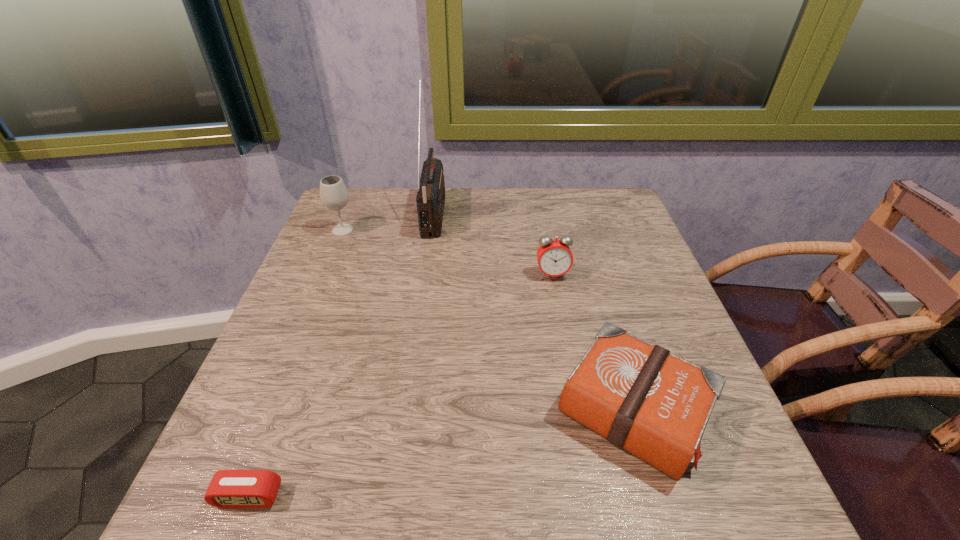
Find the location of a particular element. This screenshot has height=540, width=960. vacant space situated on the front-facing side of the third farthest object is located at coordinates (565, 347).

Locate an element on the screen. vacant area situated on the left of the Bible is located at coordinates (414, 411).

Find the location of a particular element. Image resolution: width=960 pixels, height=540 pixels. radio receiver present at the far edge is located at coordinates (430, 199).

Locate an element on the screen. The width and height of the screenshot is (960, 540). wineglass that is at the far edge is located at coordinates (334, 195).

You are a GUI agent. You are given a task and a screenshot of the screen. Output one action in this format:
    pyautogui.click(x=<x>, y=<y>)
    Task: Click on the Bible that is at the near edge
    The image size is (960, 540).
    Given the screenshot: What is the action you would take?
    pyautogui.click(x=640, y=397)

This screenshot has width=960, height=540. Identify the location of alarm clock located in the near edge section of the desktop. coord(228,488).

Identify the location of wineglass that is positioned at the left edge. This screenshot has height=540, width=960. (334, 195).

This screenshot has width=960, height=540. Identify the location of alarm clock that is at the left edge. (228, 488).

Where is `object that is at the right edge`? This screenshot has width=960, height=540. object that is at the right edge is located at coordinates (640, 397).

Locate an element on the screen. This screenshot has height=540, width=960. object located at the far left corner is located at coordinates (334, 195).